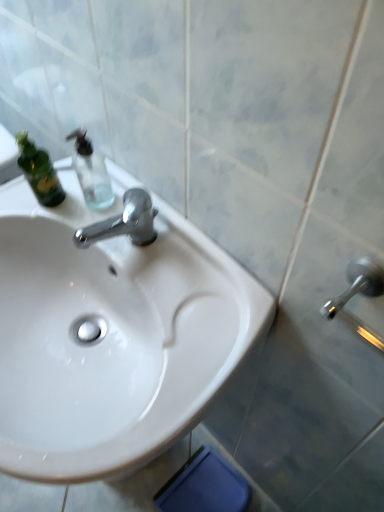
The width and height of the screenshot is (384, 512). Describe the element at coordinates (91, 172) in the screenshot. I see `transparent glass soap dispenser at upper left` at that location.

At what (x,y) coordinates should I click in order to perform the action: click on transparent glass soap dispenser at upper left. Please return your answer as a coordinate pair (x, y). This screenshot has height=512, width=384. Looking at the image, I should click on (91, 172).

In order to face white glossy sink at center, should I rotate leftwards or rightwards?

Turn left approximately 12.471 degrees to face it.

In order to click on white glossy sink at center in this screenshot , I will do `click(111, 335)`.

What is the approximate height of white glossy sink at center?

→ The height of white glossy sink at center is 30.09 inches.

What do you see at coordinates (111, 335) in the screenshot? The image size is (384, 512). I see `white glossy sink at center` at bounding box center [111, 335].

Locate an element on the screen. This screenshot has height=512, width=384. transparent glass soap dispenser at upper left is located at coordinates (91, 172).

Considering the positions of objects white glossy sink at center and transparent glass soap dispenser at upper left in the image provided, who is more to the left, white glossy sink at center or transparent glass soap dispenser at upper left?

white glossy sink at center is more to the left.

Considering their positions, is white glossy sink at center located in front of or behind transparent glass soap dispenser at upper left?

Clearly, white glossy sink at center is in front of transparent glass soap dispenser at upper left.

Is point (94, 215) closer to camera compared to point (97, 164)?

Yes, point (94, 215) is in front of point (97, 164).

From the image's perspective, which is below, white glossy sink at center or transparent glass soap dispenser at upper left?

white glossy sink at center, from the image's perspective.

From a real-world perspective, is white glossy sink at center physically located above or below transparent glass soap dispenser at upper left?

Clearly, from a real-world perspective, white glossy sink at center is below transparent glass soap dispenser at upper left.

In terms of width, does white glossy sink at center look wider or thinner when compared to transparent glass soap dispenser at upper left?

Clearly, white glossy sink at center has more width compared to transparent glass soap dispenser at upper left.

Which of these two, white glossy sink at center or transparent glass soap dispenser at upper left, stands shorter?

transparent glass soap dispenser at upper left.

Is white glossy sink at center smaller than transparent glass soap dispenser at upper left?

Incorrect, white glossy sink at center is not smaller in size than transparent glass soap dispenser at upper left.

Choose the correct answer: Is white glossy sink at center inside transparent glass soap dispenser at upper left or outside it?

The correct answer is: outside.

Are white glossy sink at center and transparent glass soap dispenser at upper left located far from each other?

No, there isn't a large distance between white glossy sink at center and transparent glass soap dispenser at upper left.

Looking at this image, is transparent glass soap dispenser at upper left at the back of white glossy sink at center?

white glossy sink at center does not have its back to transparent glass soap dispenser at upper left.

Can you tell me how much white glossy sink at center and transparent glass soap dispenser at upper left differ in facing direction?

white glossy sink at center and transparent glass soap dispenser at upper left are facing 2.42 degrees away from each other.

The image size is (384, 512). What are the coordinates of `sink on the left of transparent glass soap dispenser at upper left` in the screenshot? It's located at (111, 335).

Which object is positioned more to the left, transparent glass soap dispenser at upper left or white glossy sink at center?

white glossy sink at center.

Is transparent glass soap dispenser at upper left further to the viewer compared to white glossy sink at center?

Yes, it is.

Is point (108, 182) in front of point (204, 357)?

No, it is behind (204, 357).

From the image's perspective, is transparent glass soap dispenser at upper left above or below white glossy sink at center?

Based on their image positions, transparent glass soap dispenser at upper left is located above white glossy sink at center.

From a real-world perspective, does transparent glass soap dispenser at upper left stand above white glossy sink at center?

Correct, in the physical world, transparent glass soap dispenser at upper left is higher than white glossy sink at center.

Does transparent glass soap dispenser at upper left have a lesser width compared to white glossy sink at center?

Indeed, transparent glass soap dispenser at upper left has a lesser width compared to white glossy sink at center.

Considering the relative sizes of transparent glass soap dispenser at upper left and white glossy sink at center in the image provided, is transparent glass soap dispenser at upper left taller than white glossy sink at center?

In fact, transparent glass soap dispenser at upper left may be shorter than white glossy sink at center.

Can you confirm if transparent glass soap dispenser at upper left is bigger than white glossy sink at center?

No, transparent glass soap dispenser at upper left is not bigger than white glossy sink at center.

Can white glossy sink at center be found inside transparent glass soap dispenser at upper left?

Actually, white glossy sink at center is outside transparent glass soap dispenser at upper left.

Are transparent glass soap dispenser at upper left and white glossy sink at center located far from each other?

No, transparent glass soap dispenser at upper left is not far away from white glossy sink at center.

Is transparent glass soap dispenser at upper left aimed at white glossy sink at center?

No, transparent glass soap dispenser at upper left is not turned towards white glossy sink at center.

Locate an element on the screen. The width and height of the screenshot is (384, 512). bottle on the right of the white glossy sink at center is located at coordinates (91, 172).

Identify the location of sink below the transparent glass soap dispenser at upper left (from the image's perspective). This screenshot has height=512, width=384. (111, 335).

Find the location of a particular element. The width and height of the screenshot is (384, 512). bottle that is above the white glossy sink at center (from the image's perspective) is located at coordinates (91, 172).